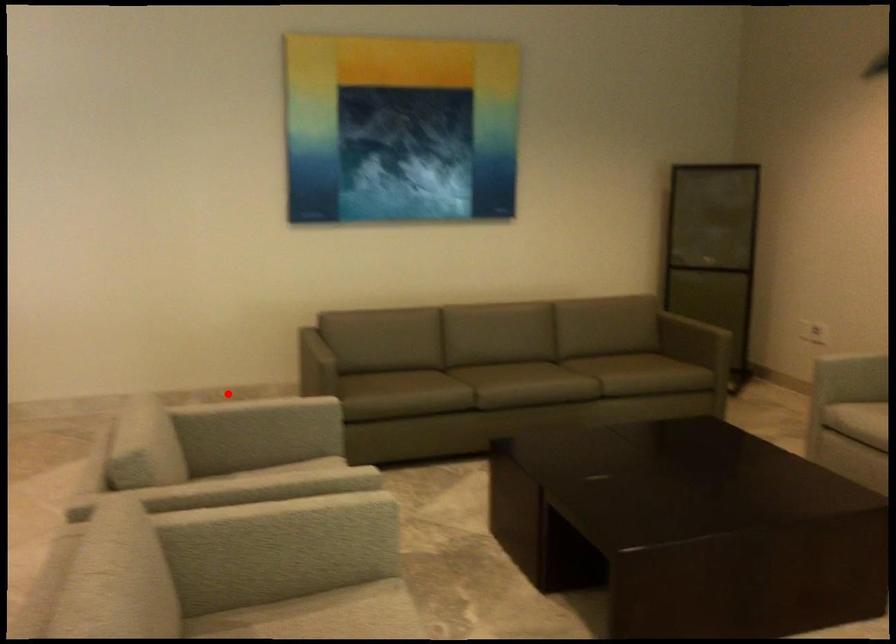
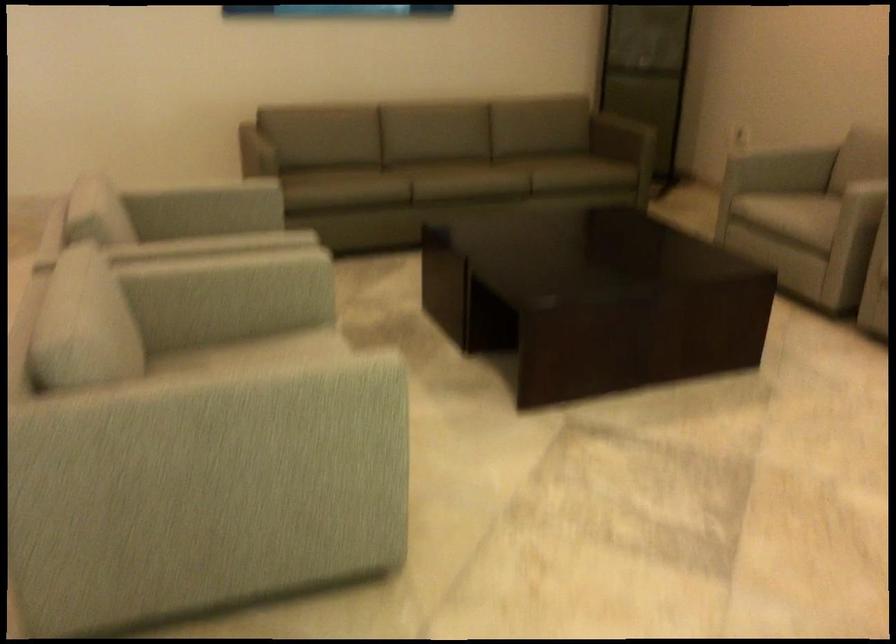
Question: A red point is marked in image1. In image2, is the corresponding 3D point closer to the camera or farther? Reply with the corresponding letter.

Choices:
 (A) The corresponding 3D point is closer.
 (B) The corresponding 3D point is farther.

Answer: (A)